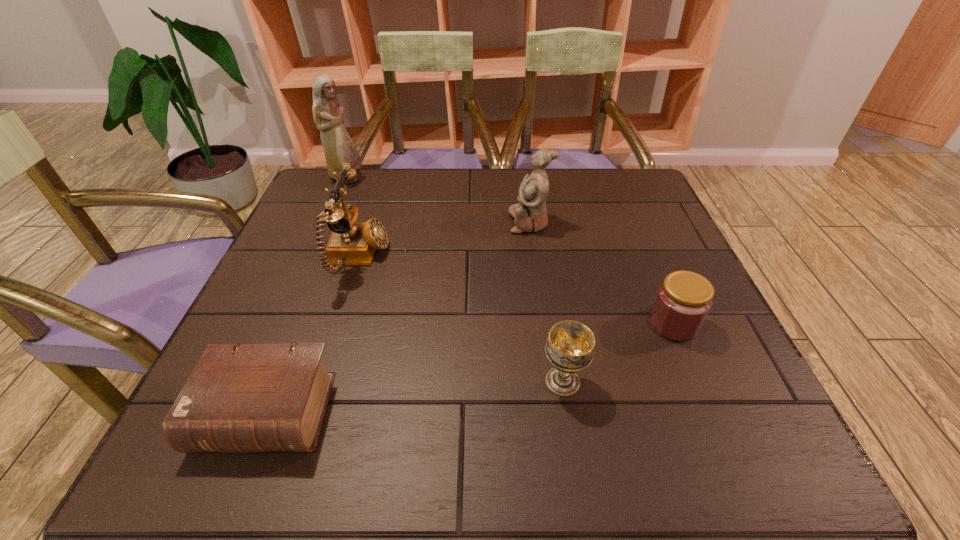
Locate an element on the screen. The image size is (960, 540). free space that satisfies the following two spatial constraints: 1. on the dial number of the telephone; 2. on the back side of the chalice is located at coordinates pos(320,382).

Locate an element on the screen. Image resolution: width=960 pixels, height=540 pixels. vacant point that satisfies the following two spatial constraints: 1. on the front-facing side of the tallest object; 2. on the back side of the chalice is located at coordinates (260, 382).

Image resolution: width=960 pixels, height=540 pixels. Find the location of `free spot that satisfies the following two spatial constraints: 1. on the back side of the jam; 2. on the dial number of the telephone`. free spot that satisfies the following two spatial constraints: 1. on the back side of the jam; 2. on the dial number of the telephone is located at coordinates pyautogui.click(x=645, y=258).

You are a GUI agent. You are given a task and a screenshot of the screen. Output one action in this format:
    pyautogui.click(x=<x>, y=<y>)
    Task: Click on the free location that satisfies the following two spatial constraints: 1. on the dial number of the telephone; 2. on the spine side of the shortest object
    The width and height of the screenshot is (960, 540).
    Given the screenshot: What is the action you would take?
    pyautogui.click(x=310, y=413)

This screenshot has height=540, width=960. Identify the location of vacant position in the image that satisfies the following two spatial constraints: 1. on the back side of the chalice; 2. on the dial number of the telephone. (542, 258).

Identify the location of blank area in the image that satisfies the following two spatial constraints: 1. on the front-facing side of the third nearest object; 2. on the right side of the shorter figurine. [x=544, y=323].

Image resolution: width=960 pixels, height=540 pixels. I want to click on vacant space that satisfies the following two spatial constraints: 1. on the dial number of the third nearest object; 2. on the left side of the telephone, so click(x=338, y=323).

Identify the location of free location that satisfies the following two spatial constraints: 1. on the front-facing side of the farthest object; 2. on the right side of the rightmost object. (284, 323).